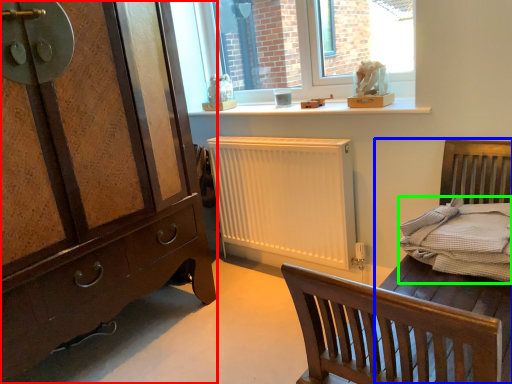
Question: Which object is the farthest from chest of drawers (highlighted by a red box)? Choose among these: bed frame (highlighted by a blue box) or bedding (highlighted by a green box).

Choices:
 (A) bed frame
 (B) bedding

Answer: (B)